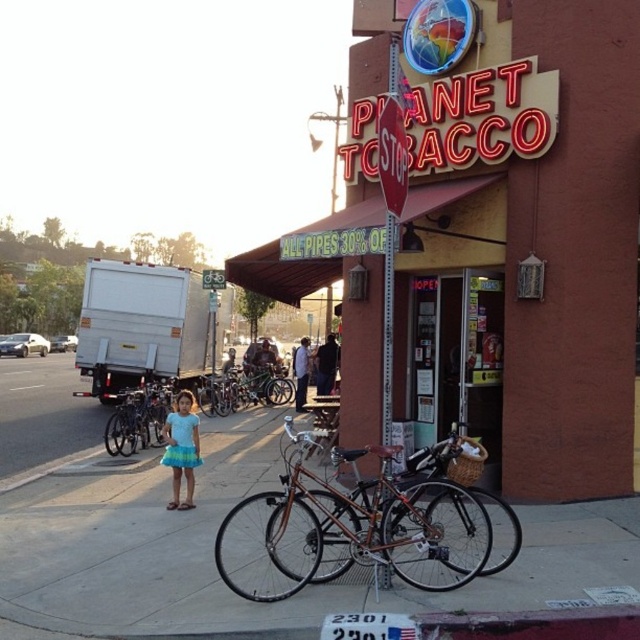
Question: Which point is closer to the camera?

Choices:
 (A) blue cotton dress at center
 (B) smooth concrete sidewalk at center

Answer: (B)

Question: Is brick building at center below shiny black bicycle at center?

Choices:
 (A) no
 (B) yes

Answer: (A)

Question: Does shiny black bicycle at center come behind blue cotton dress at center?

Choices:
 (A) yes
 (B) no

Answer: (A)

Question: Which point is closer to the camera taking this photo?

Choices:
 (A) (172, 484)
 (B) (90, 484)
 (C) (600, 61)
 (D) (124, 404)

Answer: (C)

Question: Which point is closer to the camera taking this photo?

Choices:
 (A) [616, 579]
 (B) [426, 561]
 (C) [192, 444]

Answer: (A)

Question: Does shiny metallic bicycle at center lie in front of shiny black bicycle at center?

Choices:
 (A) yes
 (B) no

Answer: (A)